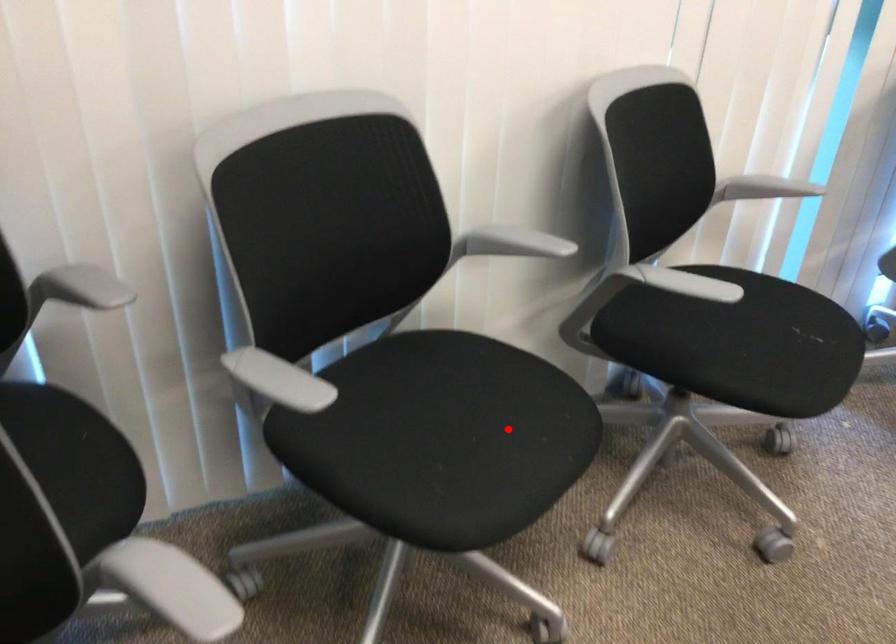
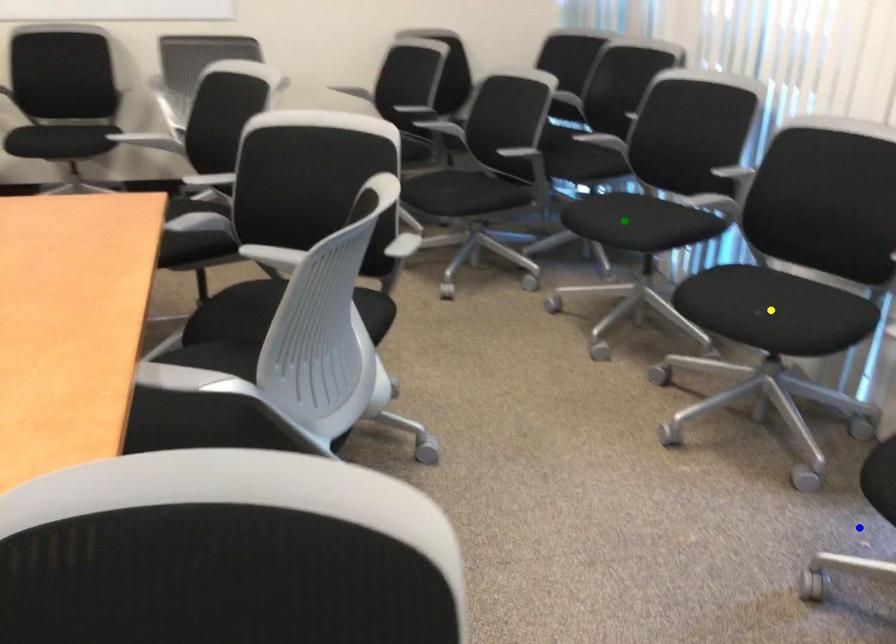
Question: I am providing you with two images of the same scene from different viewpoints. A red point is marked on the first image. You are given multiple points on the second image. Which point in image 2 is actually the same real-world point as the red point in image 1?

Choices:
 (A) green point
 (B) blue point
 (C) yellow point

Answer: (A)